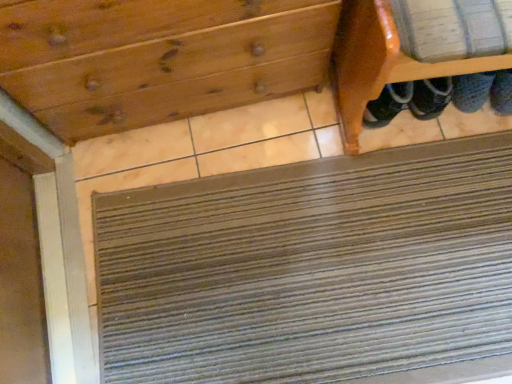
Question: From a real-world perspective, is wooden drawer at upper center on brown textured mat at lower center?

Choices:
 (A) no
 (B) yes

Answer: (B)

Question: Does wooden drawer at upper center lie behind brown textured mat at lower center?

Choices:
 (A) yes
 (B) no

Answer: (B)

Question: From the image's perspective, is wooden drawer at upper center on top of brown textured mat at lower center?

Choices:
 (A) no
 (B) yes

Answer: (B)

Question: Is there a large distance between wooden drawer at upper center and brown textured mat at lower center?

Choices:
 (A) no
 (B) yes

Answer: (A)

Question: From a real-world perspective, is wooden drawer at upper center located beneath brown textured mat at lower center?

Choices:
 (A) yes
 (B) no

Answer: (B)

Question: Looking at the image, does brown textured mat at lower center seem bigger or smaller compared to wooden shoe rack at upper right?

Choices:
 (A) small
 (B) big

Answer: (A)

Question: Is brown textured mat at lower center taller or shorter than wooden shoe rack at upper right?

Choices:
 (A) tall
 (B) short

Answer: (B)

Question: Visually, is brown textured mat at lower center positioned to the left or to the right of wooden shoe rack at upper right?

Choices:
 (A) left
 (B) right

Answer: (A)

Question: Is brown textured mat at lower center wider or thinner than wooden shoe rack at upper right?

Choices:
 (A) thin
 (B) wide

Answer: (B)

Question: Relative to brown textured mat at lower center, is wooden shoe rack at upper right in front or behind?

Choices:
 (A) front
 (B) behind

Answer: (A)

Question: From a real-world perspective, is wooden shoe rack at upper right above or below brown textured mat at lower center?

Choices:
 (A) below
 (B) above

Answer: (B)

Question: Does point (345, 132) appear closer or farther from the camera than point (334, 269)?

Choices:
 (A) closer
 (B) farther

Answer: (B)

Question: Would you say wooden shoe rack at upper right is inside or outside brown textured mat at lower center?

Choices:
 (A) outside
 (B) inside

Answer: (A)

Question: Is wooden drawer at upper center to the left or to the right of brown textured mat at lower center in the image?

Choices:
 (A) right
 (B) left

Answer: (B)

Question: From their relative heights in the image, would you say wooden drawer at upper center is taller or shorter than brown textured mat at lower center?

Choices:
 (A) short
 (B) tall

Answer: (B)